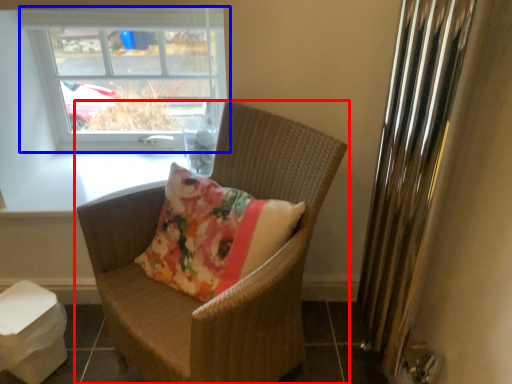
Question: Among these objects, which one is farthest to the camera, chair (highlighted by a red box) or window (highlighted by a blue box)?

Choices:
 (A) chair
 (B) window

Answer: (B)